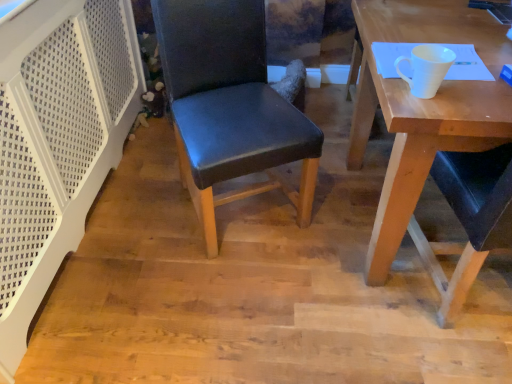
Question: Should I look upward or downward to see black leather chair at center?

Choices:
 (A) up
 (B) down

Answer: (A)

Question: Can you see wooden desk at right touching black leather chair at center?

Choices:
 (A) yes
 (B) no

Answer: (B)

Question: Is wooden desk at right at the left side of black leather chair at center?

Choices:
 (A) yes
 (B) no

Answer: (B)

Question: Is the depth of wooden desk at right less than that of black leather chair at center?

Choices:
 (A) yes
 (B) no

Answer: (A)

Question: Would you say wooden desk at right contains black leather chair at center?

Choices:
 (A) yes
 (B) no

Answer: (B)

Question: From the image's perspective, is wooden desk at right on black leather chair at center?

Choices:
 (A) no
 (B) yes

Answer: (A)

Question: From the image's perspective, would you say wooden desk at right is shown under black leather chair at center?

Choices:
 (A) no
 (B) yes

Answer: (B)

Question: Would you say white matte cup at upper right is part of wooden desk at right's contents?

Choices:
 (A) no
 (B) yes

Answer: (A)

Question: Considering the relative sizes of wooden desk at right and white matte cup at upper right in the image provided, is wooden desk at right smaller than white matte cup at upper right?

Choices:
 (A) yes
 (B) no

Answer: (B)

Question: Is wooden desk at right placed right next to white matte cup at upper right?

Choices:
 (A) no
 (B) yes

Answer: (A)

Question: Considering the relative sizes of wooden desk at right and white matte cup at upper right in the image provided, is wooden desk at right wider than white matte cup at upper right?

Choices:
 (A) no
 (B) yes

Answer: (B)

Question: From a real-world perspective, is wooden desk at right positioned under white matte cup at upper right based on gravity?

Choices:
 (A) no
 (B) yes

Answer: (B)

Question: Is wooden desk at right positioned in front of white matte cup at upper right?

Choices:
 (A) no
 (B) yes

Answer: (B)

Question: Is black leather chair at center to the right of white matte cup at upper right from the viewer's perspective?

Choices:
 (A) yes
 (B) no

Answer: (B)